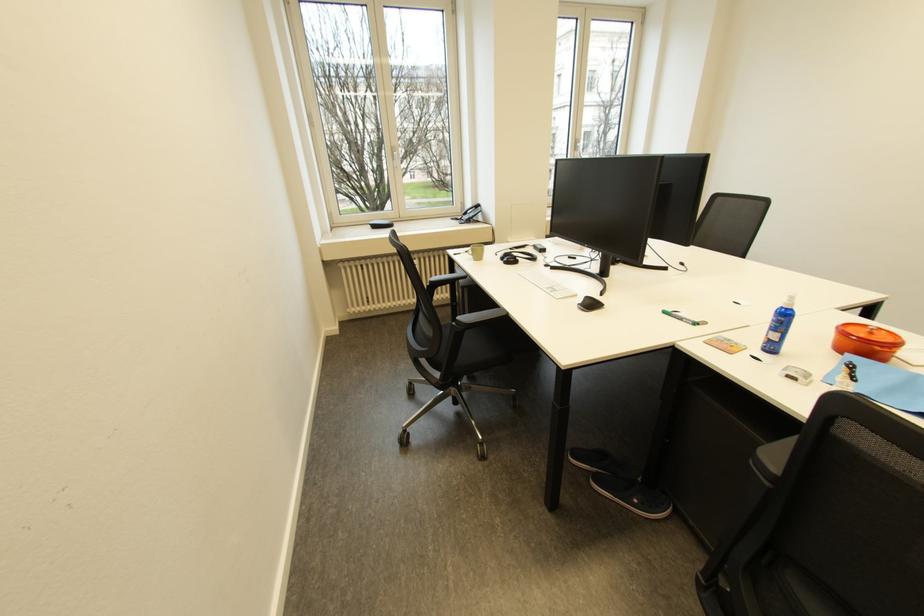
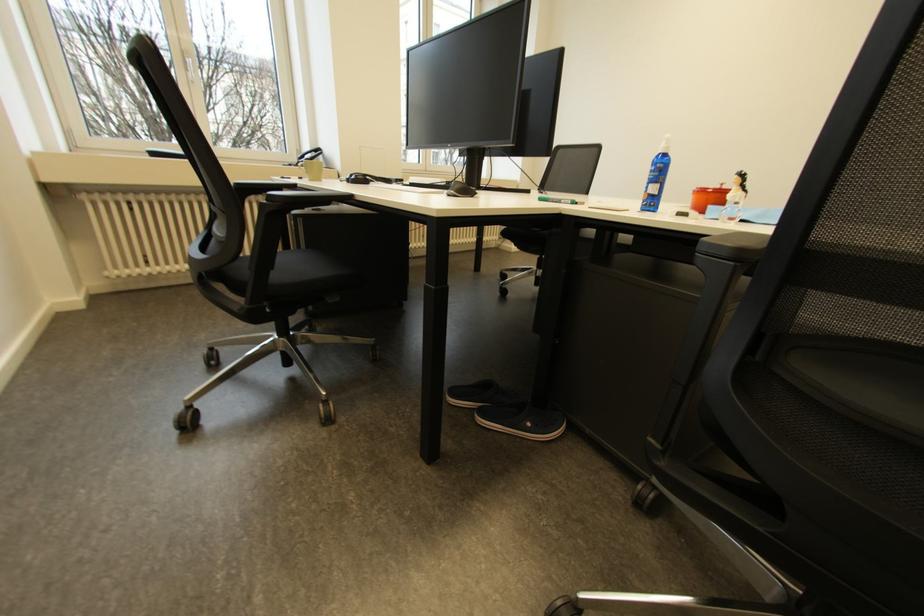
Question: The first image is from the beginning of the video and the second image is from the end. How did the camera likely rotate when shooting the video?

Choices:
 (A) Left
 (B) Right
 (C) Up
 (D) Down

Answer: (B)